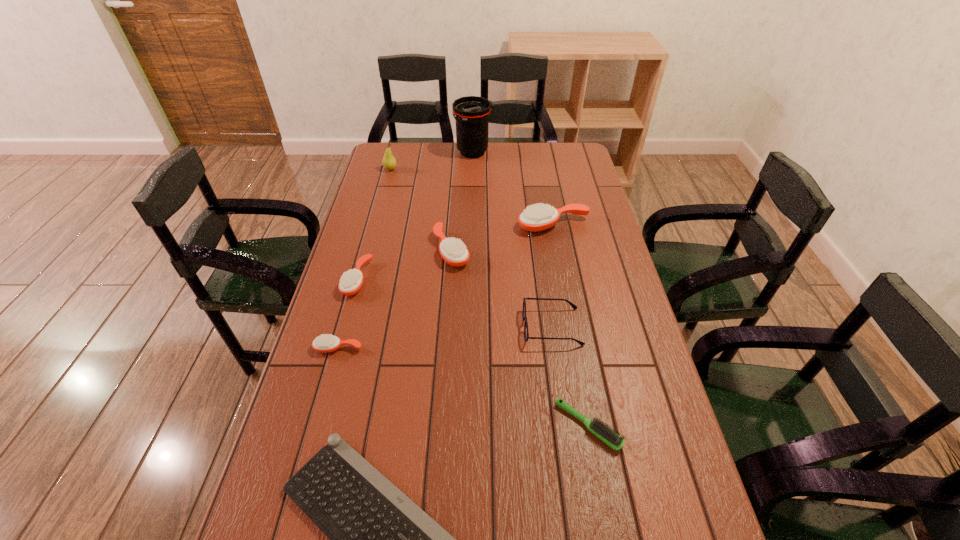
Find the location of a particular element. The width and height of the screenshot is (960, 540). vacant space at the far left corner of the desktop is located at coordinates (374, 168).

Where is `vacant space at the far right corner of the desktop`? vacant space at the far right corner of the desktop is located at coordinates (571, 145).

This screenshot has height=540, width=960. I want to click on vacant space in between the eighth nearest object and the rightmost orange hairbrush, so click(472, 197).

You are a GUI agent. You are given a task and a screenshot of the screen. Output one action in this format:
    pyautogui.click(x=<x>, y=<y>)
    Task: Click on the empty space that is in between the third shortest hairbrush and the light hairbrush
    This screenshot has width=960, height=540.
    Given the screenshot: What is the action you would take?
    pyautogui.click(x=472, y=353)

At what (x,y) coordinates should I click in order to perform the action: click on the closest object relative to the smallest orange hairbrush. Please return your answer as a coordinate pair (x, y). The image size is (960, 540). Looking at the image, I should click on (351, 281).

Locate which object ranks second in proximity to the tallest object. Please provide its 2D coordinates. Your answer should be formatted as a tuple, i.e. [(x, y)], where the tuple contains the x and y coordinates of a point satisfying the conditions above.

[(538, 217)]

You are a GUI agent. You are given a task and a screenshot of the screen. Output one action in this format:
    pyautogui.click(x=<x>, y=<y>)
    Task: Click on the second closest hairbrush to the nearest orange hairbrush
    Image resolution: width=960 pixels, height=540 pixels.
    Given the screenshot: What is the action you would take?
    pyautogui.click(x=454, y=252)

The width and height of the screenshot is (960, 540). I want to click on hairbrush object that ranks as the fourth closest to the farthest object, so click(x=325, y=343).

Find the location of `orange hairbrush that is the closest to the telephoto lens`. orange hairbrush that is the closest to the telephoto lens is located at coordinates (538, 217).

Identify the location of the second closest orange hairbrush to the spectacles. (538, 217).